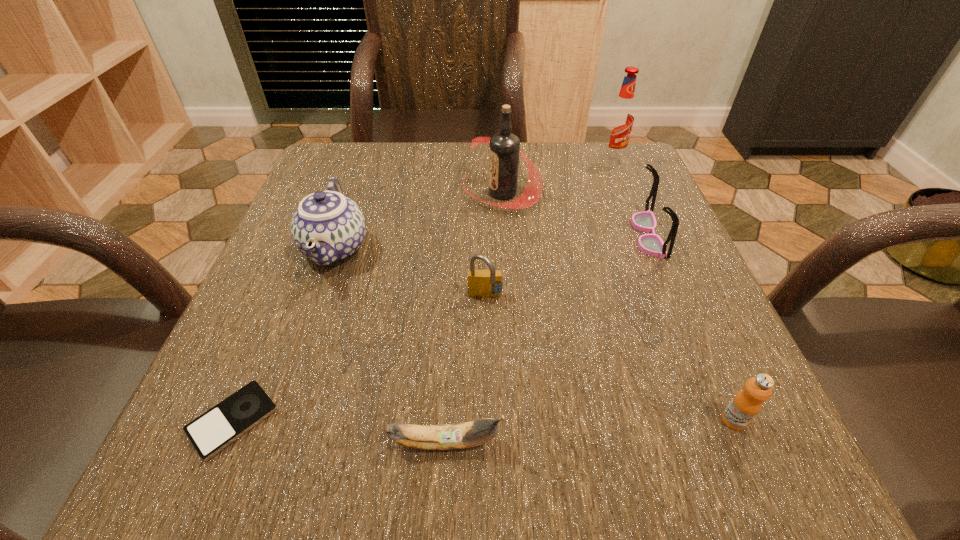
Where is `iPod located in the near edge section of the desktop`? iPod located in the near edge section of the desktop is located at coordinates (211, 432).

This screenshot has height=540, width=960. Identify the location of chinaware situated at the left edge. (327, 227).

Locate an element on the screen. The width and height of the screenshot is (960, 540). iPod present at the left edge is located at coordinates (211, 432).

Identify the location of root beer situated at the right edge. The image size is (960, 540). tap(620, 119).

Locate an element on the screen. The height and width of the screenshot is (540, 960). spectacles that is at the right edge is located at coordinates (651, 244).

Image resolution: width=960 pixels, height=540 pixels. Identify the location of orange juice at the right edge. (746, 404).

This screenshot has width=960, height=540. I want to click on object positioned at the near left corner, so click(x=211, y=432).

Where is `object situated at the far right corner`? The height and width of the screenshot is (540, 960). object situated at the far right corner is located at coordinates (620, 119).

In order to click on object present at the near right corner in this screenshot , I will do `click(746, 404)`.

In the image, there is a desktop. At what (x,y) coordinates should I click in order to perform the action: click on free space at the far edge. Please return your answer as a coordinate pair (x, y). The width and height of the screenshot is (960, 540). Looking at the image, I should click on (443, 156).